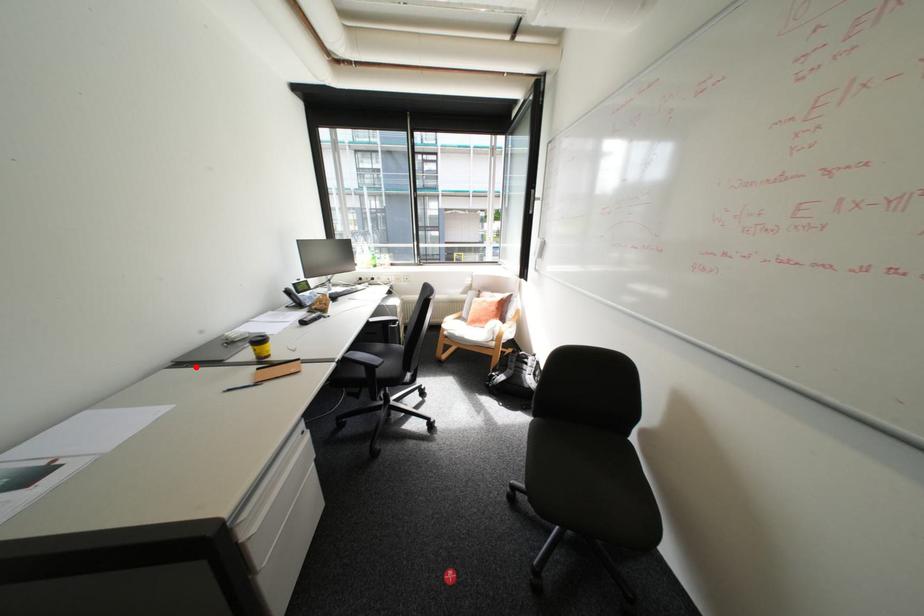
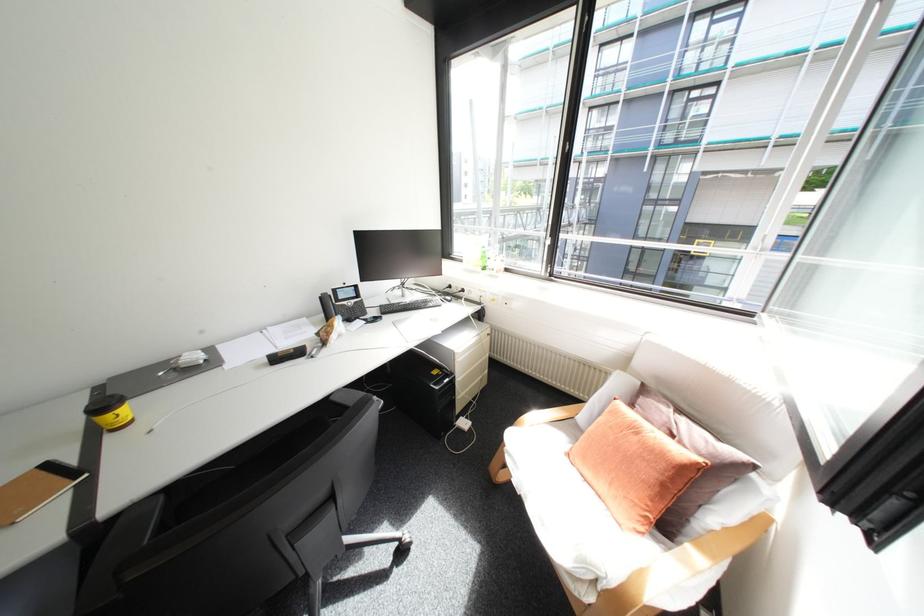
Question: I am providing you with two images of the same scene from different viewpoints. A red point is marked on the first image. Can you still see the location of the red point in image 2?

Choices:
 (A) Yes
 (B) No

Answer: (A)